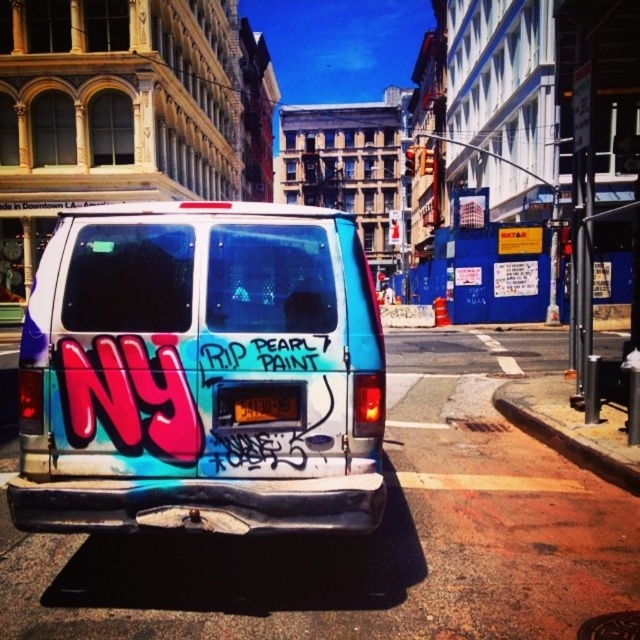
Does matte graffiti van at center have a greater height compared to brown concrete curb at lower right?

Correct, matte graffiti van at center is much taller as brown concrete curb at lower right.

Is point (342, 470) farther from camera compared to point (564, 435)?

That is False.

You are a GUI agent. You are given a task and a screenshot of the screen. Output one action in this format:
    pyautogui.click(x=<x>, y=<y>)
    Task: Click on the matte graffiti van at center
    The image size is (640, 640).
    Given the screenshot: What is the action you would take?
    pyautogui.click(x=196, y=372)

Between matte graffiti van at center and black plastic license plate at rear center, which one is positioned lower?

black plastic license plate at rear center is lower down.

Does matte graffiti van at center appear over black plastic license plate at rear center?

Yes, matte graffiti van at center is above black plastic license plate at rear center.

The height and width of the screenshot is (640, 640). What are the coordinates of `matte graffiti van at center` in the screenshot? It's located at (196, 372).

Is white matte text at center in front of black plastic license plate at rear center?

Yes, white matte text at center is closer to the viewer.

Does point (204, 349) come in front of point (296, 420)?

That is True.

Is point (278, 368) farther from camera compared to point (285, 401)?

No, it is not.

Locate an element on the screen. white matte text at center is located at coordinates click(x=264, y=353).